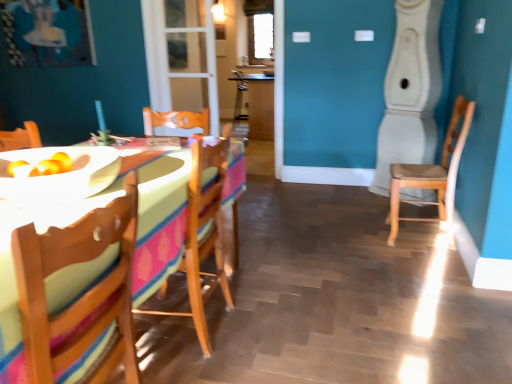
Question: Can you confirm if wooden chair at left, which is counted as the third chair, starting from the back, is positioned to the right of transparent glass door at center?

Choices:
 (A) no
 (B) yes

Answer: (B)

Question: Is wooden chair at left, which is counted as the third chair, starting from the back, smaller than transparent glass door at center?

Choices:
 (A) no
 (B) yes

Answer: (A)

Question: From a real-world perspective, is wooden chair at left, which ranks as the third chair in right-to-left order, positioned over transparent glass door at center based on gravity?

Choices:
 (A) no
 (B) yes

Answer: (A)

Question: Is wooden chair at left, which is counted as the third chair, starting from the back, facing away from transparent glass door at center?

Choices:
 (A) no
 (B) yes

Answer: (A)

Question: From the image's perspective, is wooden chair at left, which is counted as the first chair, starting from the front, below transparent glass door at center?

Choices:
 (A) yes
 (B) no

Answer: (A)

Question: Considering the relative sizes of wooden chair at left, the first chair viewed from the left, and transparent glass door at center in the image provided, is wooden chair at left, the first chair viewed from the left, bigger than transparent glass door at center?

Choices:
 (A) yes
 (B) no

Answer: (A)

Question: Does wooden chair at right, the 1th chair in the right-to-left sequence, have a lesser height compared to transparent glass door at center?

Choices:
 (A) yes
 (B) no

Answer: (A)

Question: Is wooden chair at right, the 1th chair in the right-to-left sequence, with transparent glass door at center?

Choices:
 (A) no
 (B) yes

Answer: (A)

Question: From a real-world perspective, is wooden chair at right, which ranks as the first chair in back-to-front order, over transparent glass door at center?

Choices:
 (A) yes
 (B) no

Answer: (B)

Question: Is the depth of wooden chair at right, acting as the third chair starting from the left, greater than that of transparent glass door at center?

Choices:
 (A) yes
 (B) no

Answer: (B)

Question: Is wooden chair at right, which ranks as the first chair in back-to-front order, smaller than transparent glass door at center?

Choices:
 (A) yes
 (B) no

Answer: (B)

Question: Is wooden chair at right, which ranks as the first chair in back-to-front order, closer to camera compared to transparent glass door at center?

Choices:
 (A) no
 (B) yes

Answer: (B)

Question: Is wooden chair at right, acting as the third chair starting from the left, to the left of wooden chair at center, placed as the 2th chair when sorted from right to left, from the viewer's perspective?

Choices:
 (A) yes
 (B) no

Answer: (B)